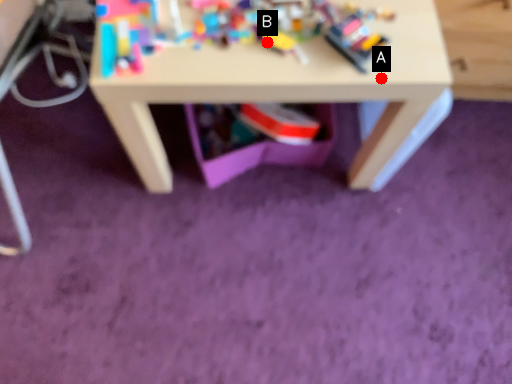
Question: Two points are circled on the image, labeled by A and B beside each circle. Among these points, which one is farthest from the camera?

Choices:
 (A) A is further
 (B) B is further

Answer: (B)